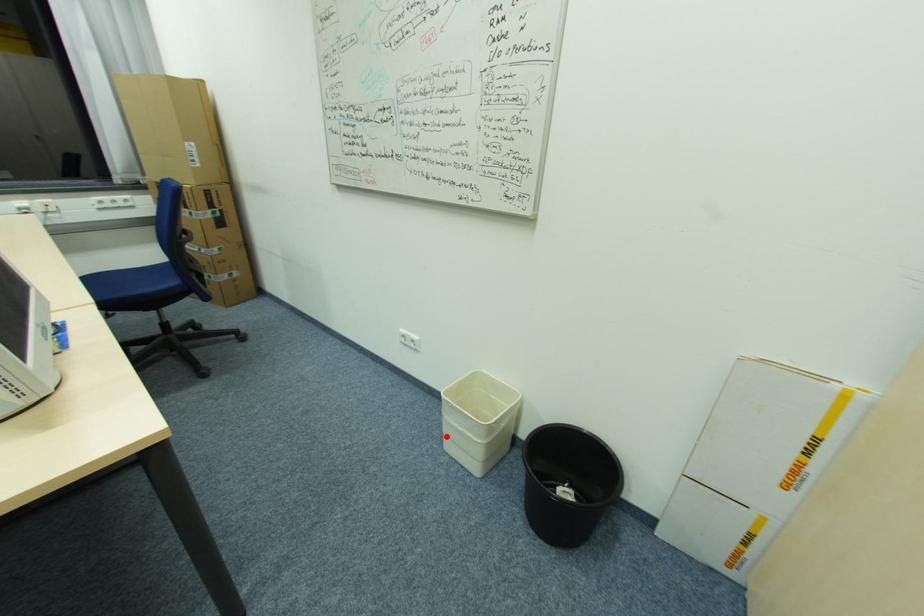
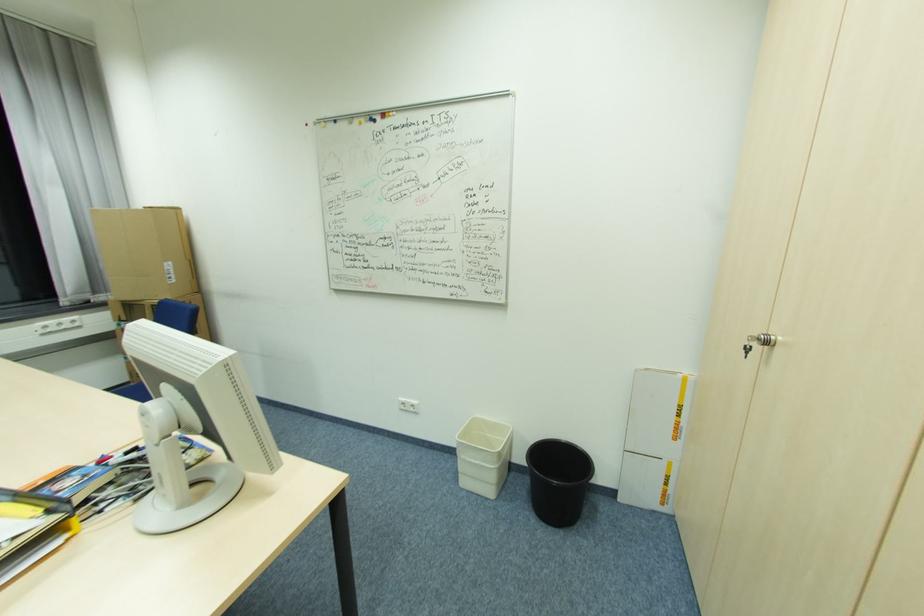
The point at the highlighted location is marked in the first image. Where is the corresponding point in the second image?

(463, 475)